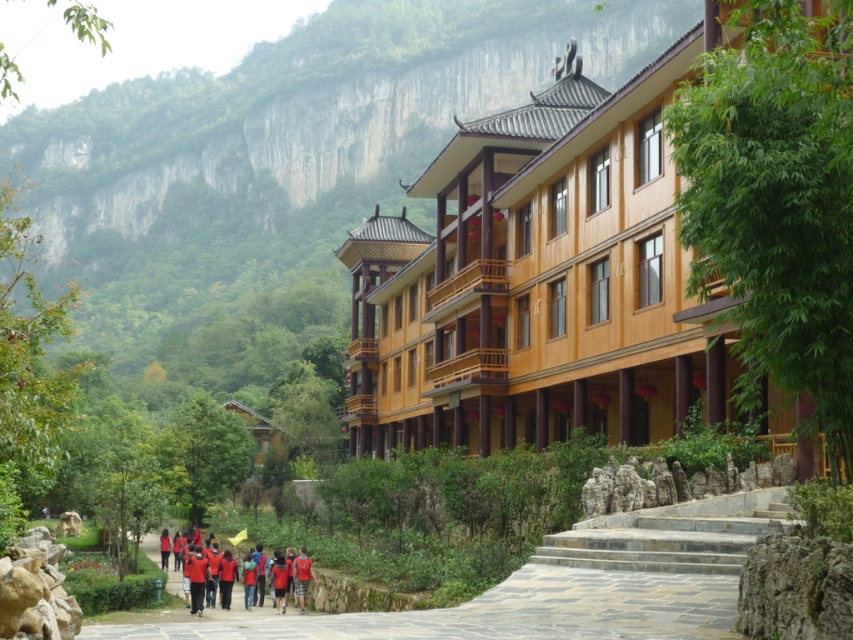
Does smooth stone pathway at center appear on the right side of red fabric group at center?

Indeed, smooth stone pathway at center is positioned on the right side of red fabric group at center.

Is point (688, 600) positioned after point (218, 545)?

That is False.

Identify the location of smooth stone pathway at center. Image resolution: width=853 pixels, height=640 pixels. (563, 584).